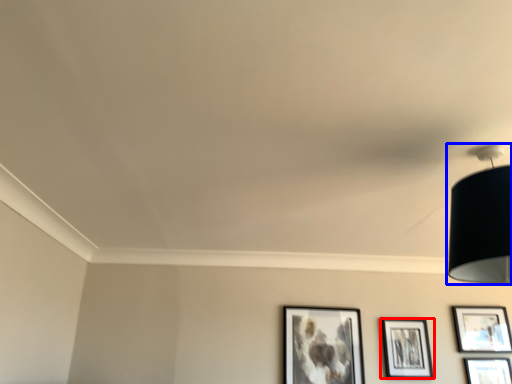
Question: Which object appears closest to the camera in this image, picture frame (highlighted by a red box) or lamp (highlighted by a blue box)?

Choices:
 (A) picture frame
 (B) lamp

Answer: (B)